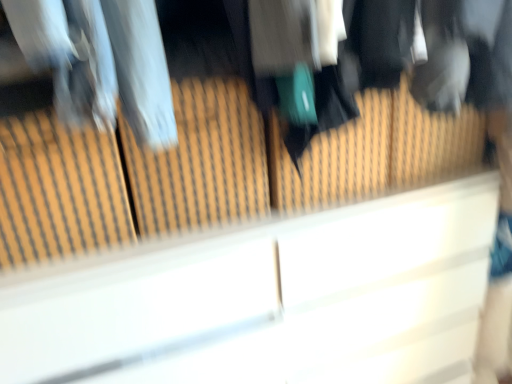
What is the approximate width of white glossy drawer at center?

white glossy drawer at center is 17.32 inches wide.

Image resolution: width=512 pixels, height=384 pixels. Describe the element at coordinates (268, 300) in the screenshot. I see `white glossy drawer at center` at that location.

Where is `white glossy drawer at center`? The width and height of the screenshot is (512, 384). white glossy drawer at center is located at coordinates (268, 300).

What is the approximate height of white glossy drawer at center?

white glossy drawer at center is 3.29 feet tall.

In order to click on white glossy drawer at center in this screenshot , I will do click(x=268, y=300).